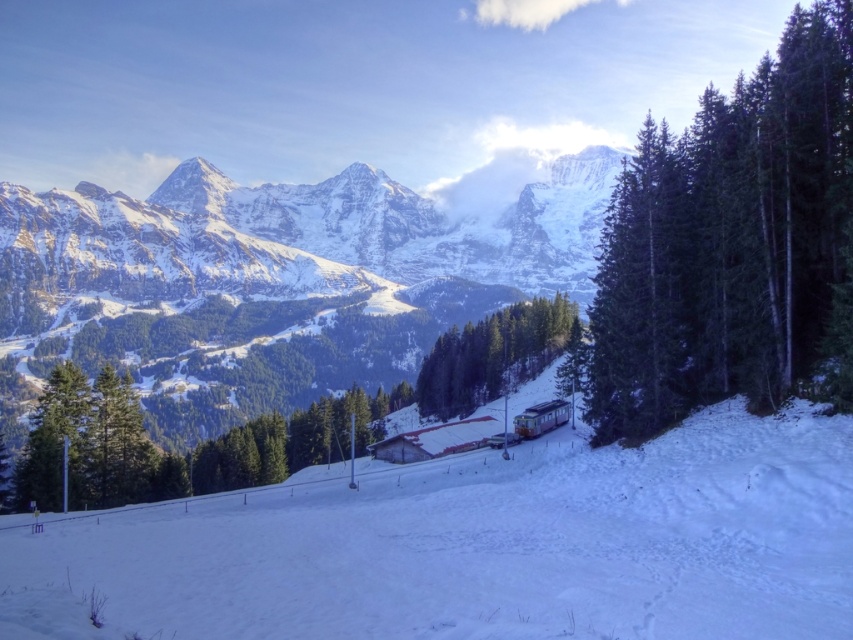
Image resolution: width=853 pixels, height=640 pixels. What do you see at coordinates (728, 241) in the screenshot? I see `green matte tree at right` at bounding box center [728, 241].

Based on the photo, who is more forward, (x=746, y=150) or (x=180, y=196)?

Point (x=746, y=150) is more forward.

Does point (714, 189) come closer to viewer compared to point (231, 289)?

Yes.

The image size is (853, 640). Identify the location of green matte tree at right. (728, 241).

Between point (778, 452) and point (666, 209), which one is positioned in front?

Point (778, 452)

Does white snow ski slope at center have a larger size compared to green matte tree at right?

Actually, white snow ski slope at center might be smaller than green matte tree at right.

Where is `white snow ski slope at center`? white snow ski slope at center is located at coordinates (480, 545).

Is point (45, 593) positioned in front of point (379, 282)?

Yes, it is.

Does white snow ski slope at center have a lesser width compared to snowy granite mountain range at upper center?

Yes, white snow ski slope at center is thinner than snowy granite mountain range at upper center.

Is point (534, 595) less distant than point (334, 240)?

Yes.

Where is `white snow ski slope at center`? The image size is (853, 640). white snow ski slope at center is located at coordinates (480, 545).